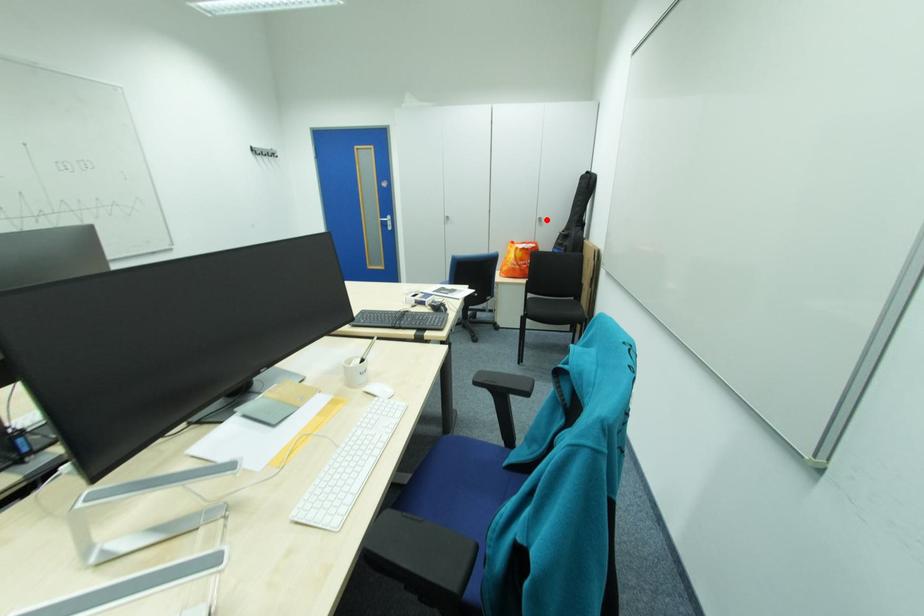
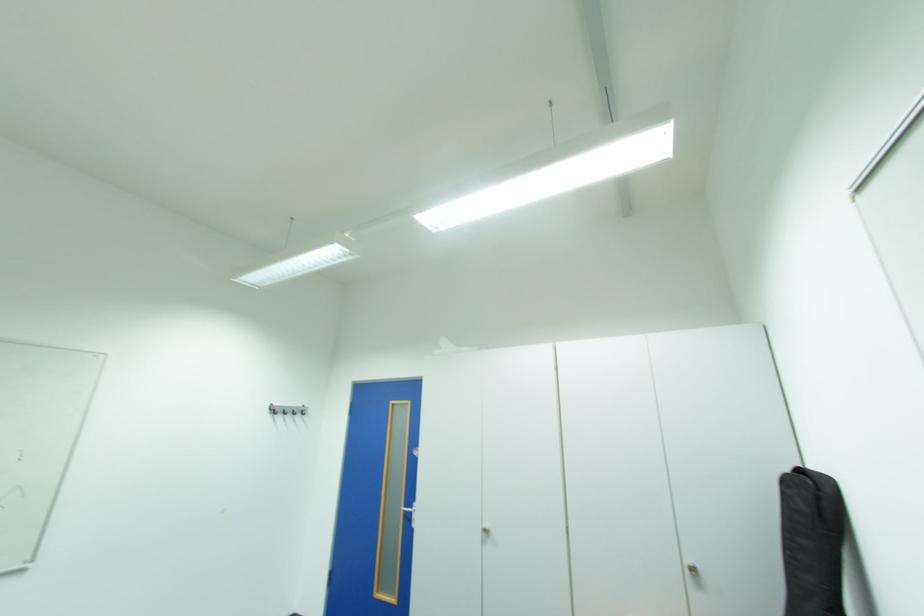
Find the pixel in the second image that matches the highlighted location in the first image.

(697, 570)